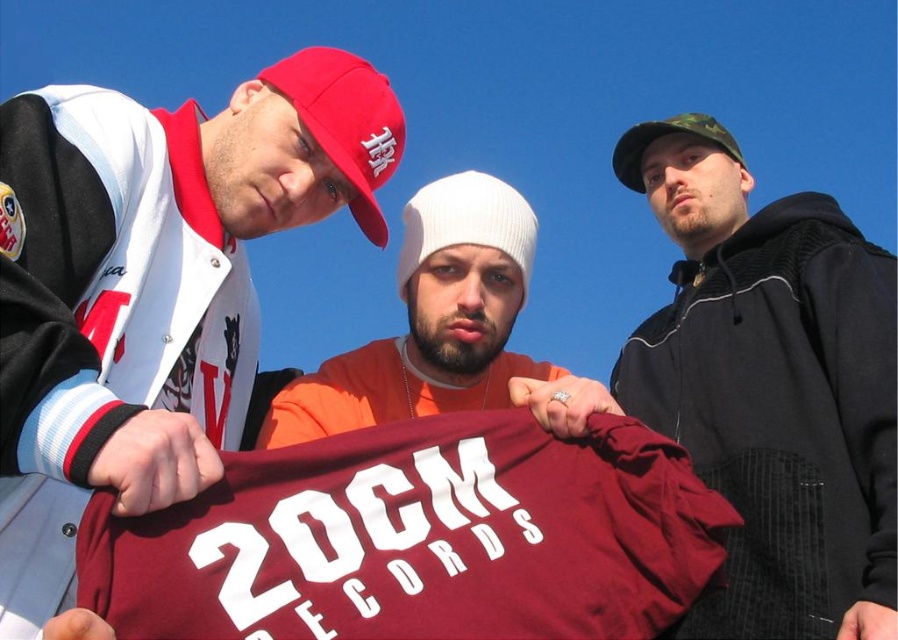
Does camo fabric cap at upper right have a greater height compared to orange cotton shirt at center?

Yes.

Does camo fabric cap at upper right appear under orange cotton shirt at center?

No, camo fabric cap at upper right is not below orange cotton shirt at center.

Identify the location of camo fabric cap at upper right. (771, 385).

Between camo fabric cap at upper right and camo fabric baseball cap at upper right, which one is positioned lower?

Positioned lower is camo fabric cap at upper right.

Which is in front, point (816, 618) or point (722, 144)?

Point (816, 618)

Who is more forward, (850, 253) or (627, 180)?

Point (850, 253)

Locate an element on the screen. The image size is (898, 640). camo fabric cap at upper right is located at coordinates (771, 385).

Who is lower down, matte white jacket at upper left or matte red baseball cap at upper left?

matte white jacket at upper left is lower down.

From the picture: Is matte white jacket at upper left smaller than matte red baseball cap at upper left?

Actually, matte white jacket at upper left might be larger than matte red baseball cap at upper left.

This screenshot has height=640, width=898. In order to click on matte white jacket at upper left in this screenshot , I will do `click(151, 285)`.